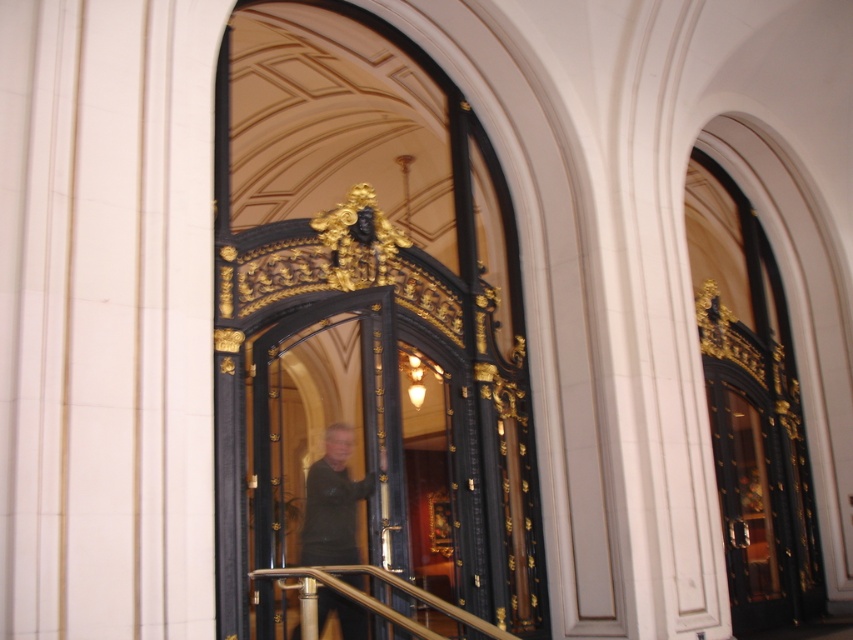
Question: Does polished dark wood door at center appear on the right side of dark green fabric jacket at center?

Choices:
 (A) yes
 (B) no

Answer: (B)

Question: Among these objects, which one is farthest from the camera?

Choices:
 (A) polished dark wood door at center
 (B) polished brass railing at center
 (C) dark green fabric jacket at center

Answer: (A)

Question: Considering the relative positions of polished dark wood door at center and polished brass railing at center in the image provided, where is polished dark wood door at center located with respect to polished brass railing at center?

Choices:
 (A) below
 (B) above

Answer: (B)

Question: Which object appears farthest from the camera in this image?

Choices:
 (A) polished dark wood door at center
 (B) dark green fabric jacket at center
 (C) polished brass railing at center

Answer: (A)

Question: Which point appears closest to the camera in this image?

Choices:
 (A) (335, 444)
 (B) (282, 573)

Answer: (B)

Question: From the image, what is the correct spatial relationship of dark green fabric jacket at center in relation to polished brass railing at center?

Choices:
 (A) below
 (B) above

Answer: (B)